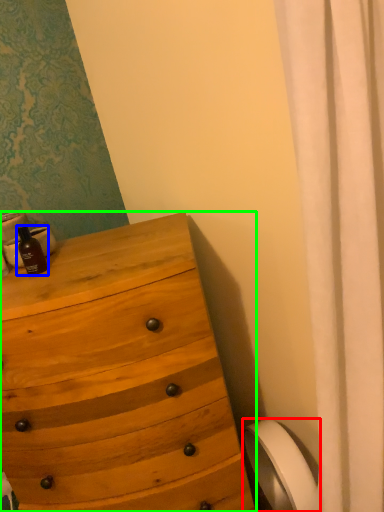
Question: Which is farther away from toilet paper (highlighted by a red box)? bottle (highlighted by a blue box) or chest of drawers (highlighted by a green box)?

Choices:
 (A) bottle
 (B) chest of drawers

Answer: (A)